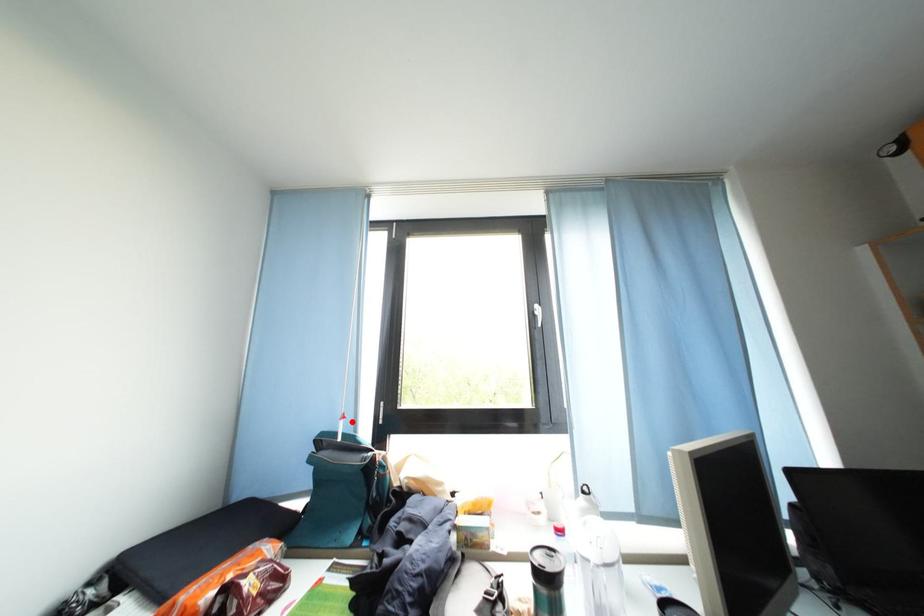
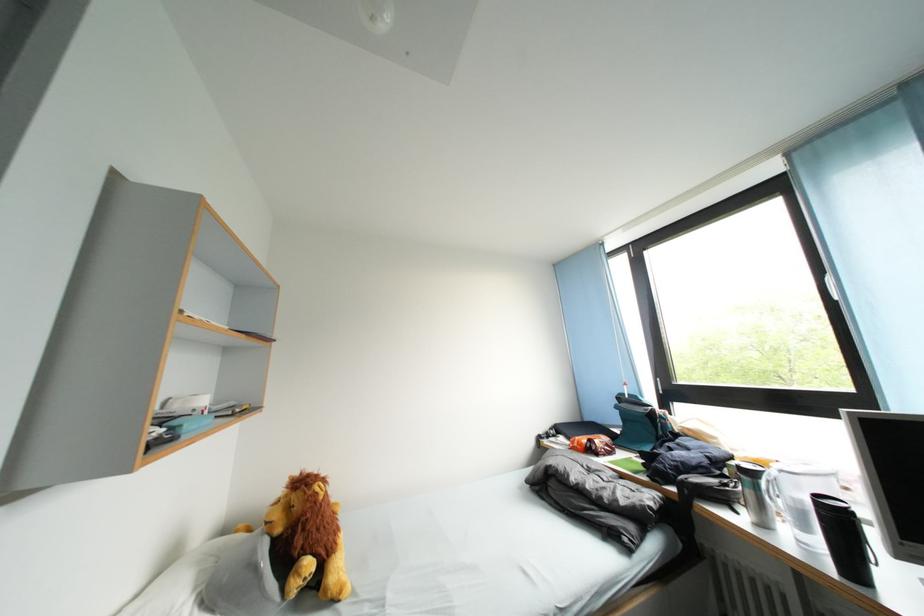
The point at the highlighted location is marked in the first image. Where is the corresponding point in the second image?

(634, 389)